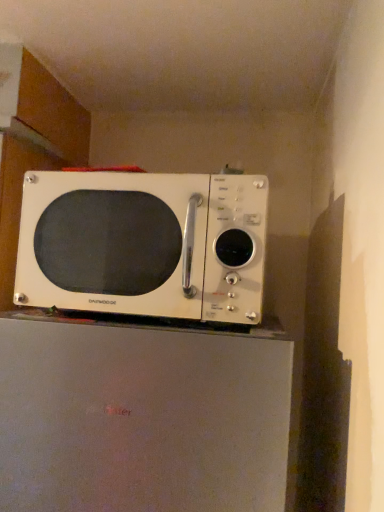
Question: From the image's perspective, is white matte microwave at upper center above white matte microwave at upper center?

Choices:
 (A) yes
 (B) no

Answer: (A)

Question: Is white matte microwave at upper center behind white matte microwave at upper center?

Choices:
 (A) yes
 (B) no

Answer: (A)

Question: Is white matte microwave at upper center outside of white matte microwave at upper center?

Choices:
 (A) yes
 (B) no

Answer: (A)

Question: Could you tell me if white matte microwave at upper center is facing white matte microwave at upper center?

Choices:
 (A) yes
 (B) no

Answer: (B)

Question: Is white matte microwave at upper center to the left of white matte microwave at upper center from the viewer's perspective?

Choices:
 (A) no
 (B) yes

Answer: (A)

Question: Is white matte microwave at upper center far away from white matte microwave at upper center?

Choices:
 (A) yes
 (B) no

Answer: (B)

Question: From the image's perspective, does white matte microwave at upper center appear lower than white matte microwave at upper center?

Choices:
 (A) yes
 (B) no

Answer: (A)

Question: Is white matte microwave at upper center facing towards white matte microwave at upper center?

Choices:
 (A) no
 (B) yes

Answer: (A)

Question: From a real-world perspective, is white matte microwave at upper center positioned under white matte microwave at upper center based on gravity?

Choices:
 (A) yes
 (B) no

Answer: (A)

Question: Considering the relative sizes of white matte microwave at upper center and white matte microwave at upper center in the image provided, is white matte microwave at upper center bigger than white matte microwave at upper center?

Choices:
 (A) yes
 (B) no

Answer: (A)

Question: From the image's perspective, is white matte microwave at upper center above white matte microwave at upper center?

Choices:
 (A) no
 (B) yes

Answer: (A)

Question: Can you confirm if white matte microwave at upper center is thinner than white matte microwave at upper center?

Choices:
 (A) yes
 (B) no

Answer: (B)

Question: Is white matte microwave at upper center taller or shorter than white matte microwave at upper center?

Choices:
 (A) tall
 (B) short

Answer: (A)